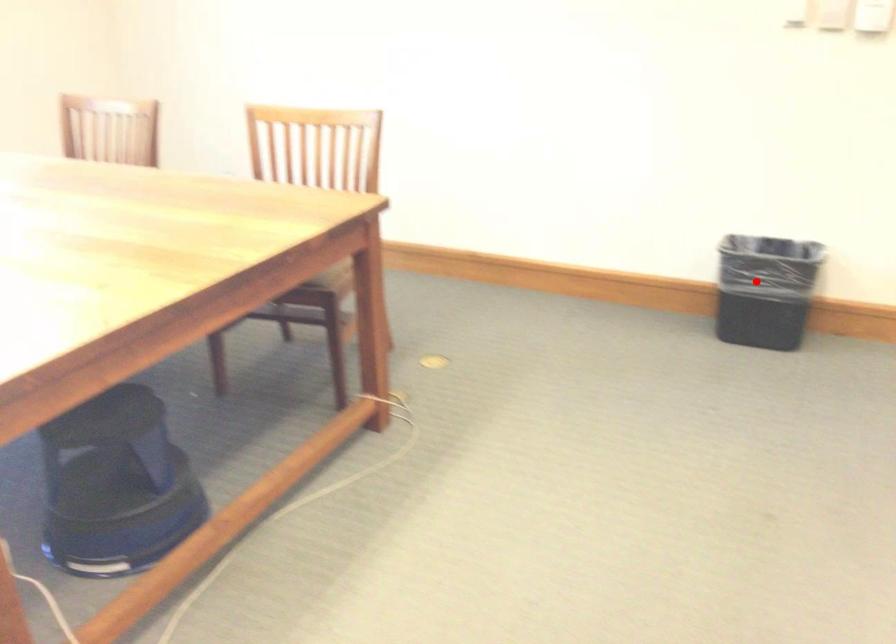
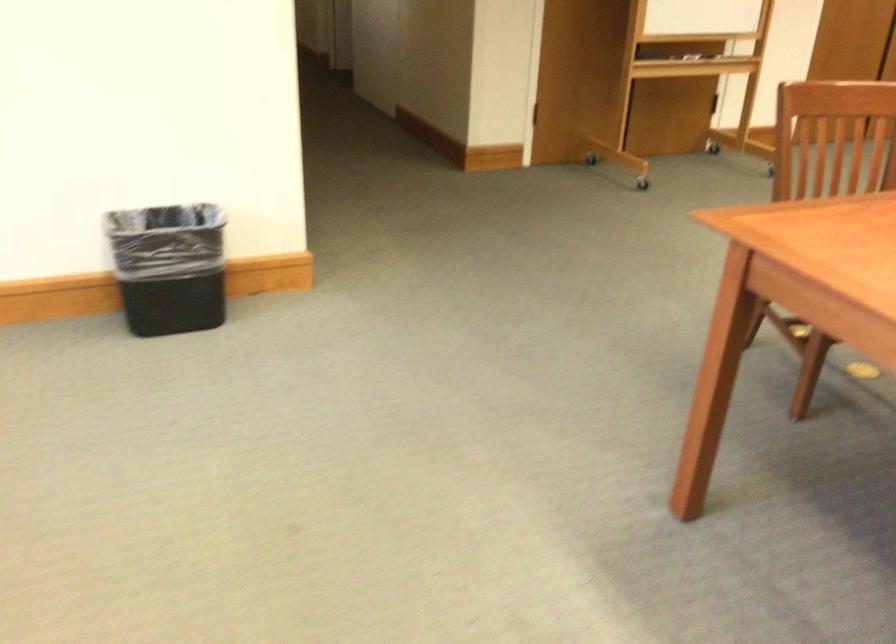
Locate, in the second image, the point that corresponds to the highlighted location in the first image.

(168, 267)